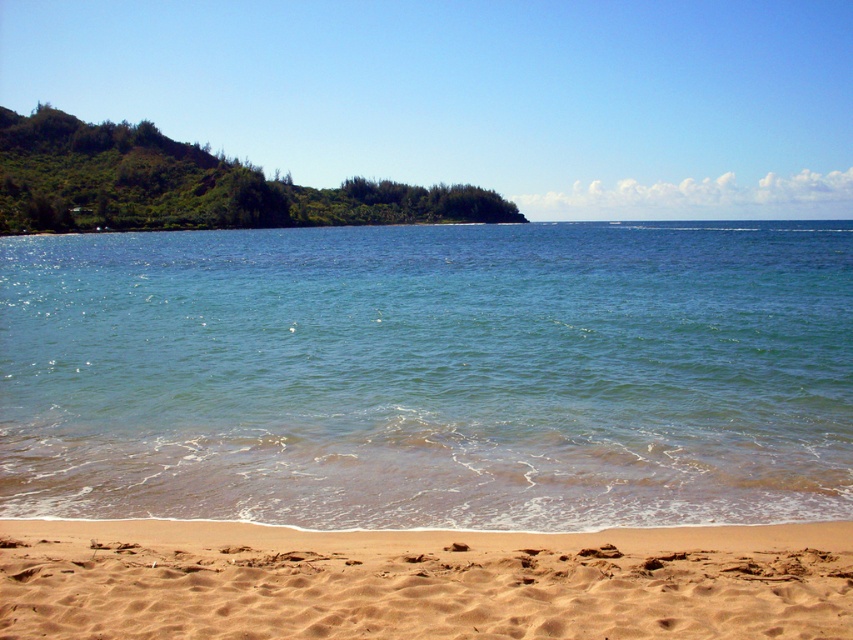
Question: Which of the following is the farthest from the observer?

Choices:
 (A) clear blue water at center
 (B) brown sandy beach at lower center

Answer: (A)

Question: Which point is farther to the camera?

Choices:
 (A) (825, 556)
 (B) (270, 467)

Answer: (B)

Question: Can you confirm if clear blue water at center is positioned above brown sandy beach at lower center?

Choices:
 (A) no
 (B) yes

Answer: (B)

Question: Considering the relative positions of clear blue water at center and brown sandy beach at lower center in the image provided, where is clear blue water at center located with respect to brown sandy beach at lower center?

Choices:
 (A) right
 (B) left

Answer: (A)

Question: Does clear blue water at center appear on the right side of brown sandy beach at lower center?

Choices:
 (A) no
 (B) yes

Answer: (B)